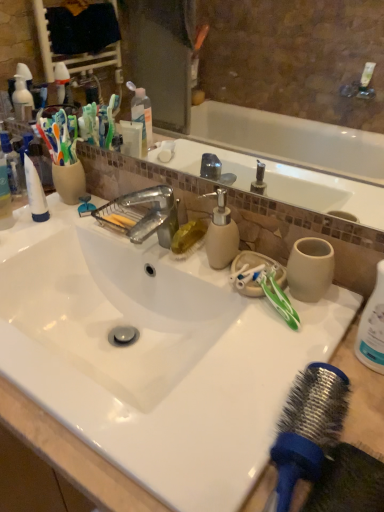
Locate an element on the screen. This screenshot has height=512, width=384. free space in front of white glossy toothpaste at left is located at coordinates (33, 246).